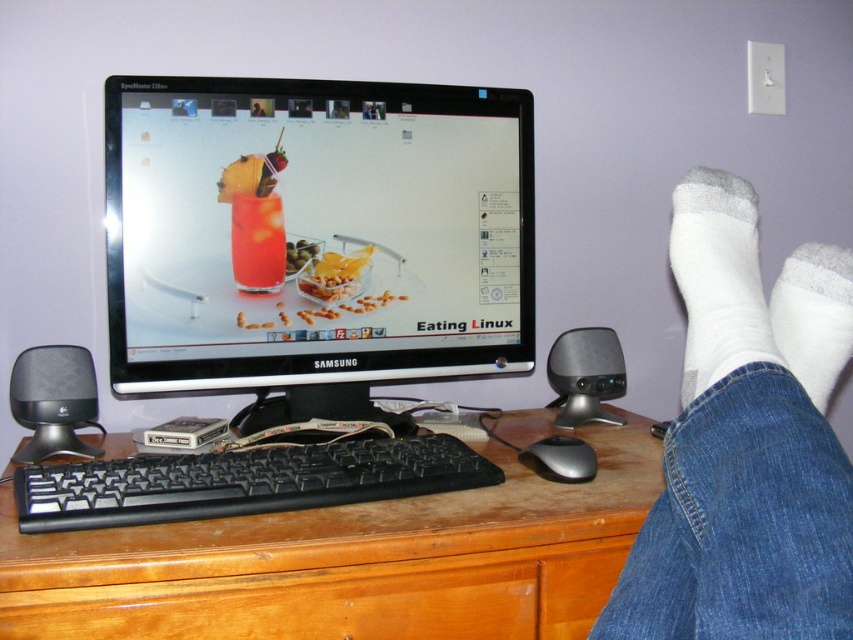
Question: Does black plastic speaker at left have a smaller size compared to black plastic mouse at lower center?

Choices:
 (A) no
 (B) yes

Answer: (A)

Question: From the image, what is the correct spatial relationship of black plastic keyboard at center in relation to white cotton sock at upper right?

Choices:
 (A) below
 (B) above

Answer: (A)

Question: Which of these objects is positioned closest to the black plastic mouse at lower center?

Choices:
 (A) glossy wood drawer at lower center
 (B) silver metallic speaker at lower right

Answer: (A)

Question: Which point appears closest to the camera in this image?

Choices:
 (A) (238, 456)
 (B) (596, 621)

Answer: (B)

Question: Which point is farther to the camera?

Choices:
 (A) black plastic keyboard at center
 (B) black plastic mouse at lower center
 (C) translucent glass drink at center

Answer: (C)

Question: Where is white cotton sock at upper right located in relation to black plastic speaker at left in the image?

Choices:
 (A) left
 (B) right

Answer: (B)